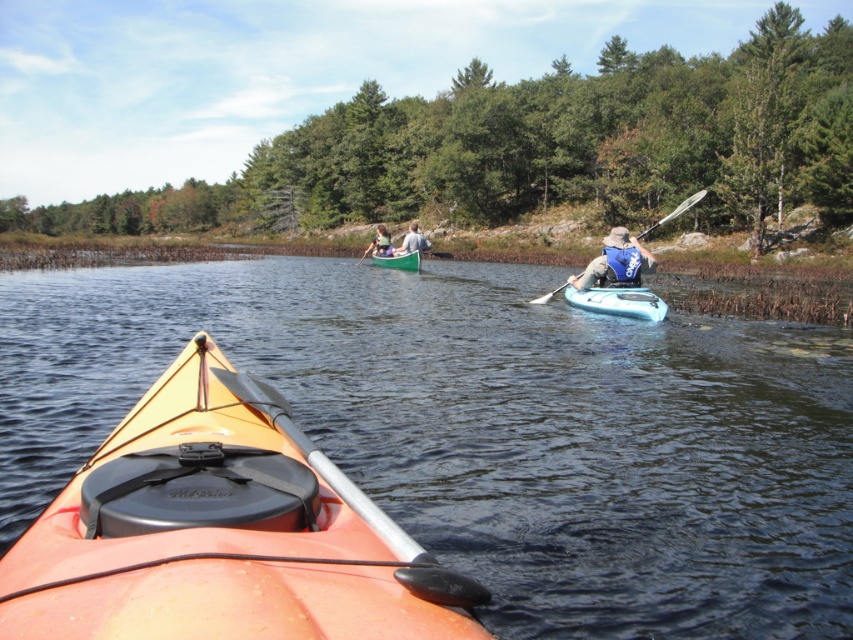
You are in the orange matte kayak at lower left and want to reach the light brown wooden paddle at center. Can you directly move forward without obstacles?

The orange matte kayak at lower left is in front of the light brown wooden paddle at center, so moving forward might lead to collision. You should adjust your direction to avoid the paddle.

You are in a kayak and need to reach for your life vest. Based on the scene, which object is lower in height between the orange kayak at center and the blue life vest at center?

The orange kayak at center has a lesser height compared to the blue life vest at center, so the orange kayak at center is lower in height.